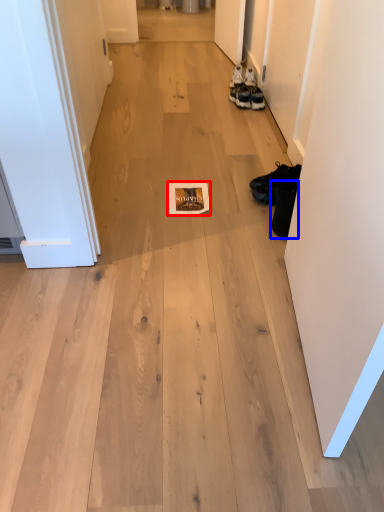
Question: Among these objects, which one is farthest to the camera, magazine (highlighted by a red box) or footwear (highlighted by a blue box)?

Choices:
 (A) magazine
 (B) footwear

Answer: (A)